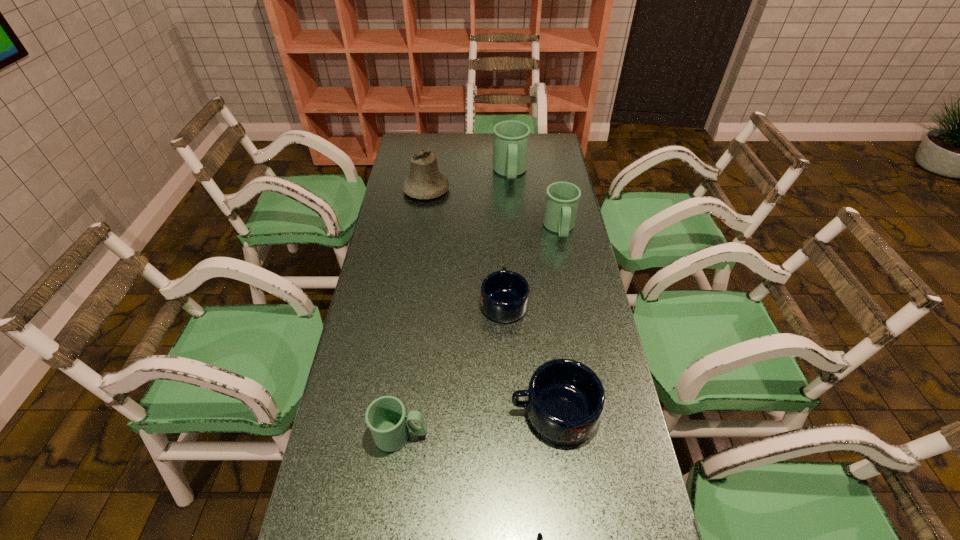
The height and width of the screenshot is (540, 960). I want to click on free space that satisfies the following two spatial constraints: 1. on the side of the fifth shortest mug with the handle; 2. on the side of the nearest green mug with the handle, so click(600, 435).